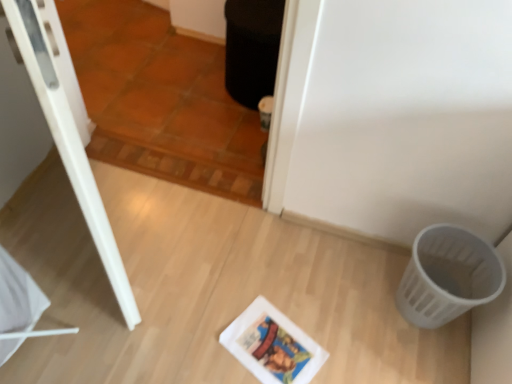
Find the location of a particular element. white plastic basket at lower right is located at coordinates (448, 276).

Find the location of a particular element. matte white comic book at center is located at coordinates (272, 345).

What's the angular difference between white plastic basket at lower right and matte white comic book at center's facing directions?

25.3 degrees separate the facing orientations of white plastic basket at lower right and matte white comic book at center.

Considering the relative positions of white plastic basket at lower right and matte white comic book at center in the image provided, is white plastic basket at lower right in front of matte white comic book at center?

Yes, the depth of white plastic basket at lower right is less than that of matte white comic book at center.

Is white plastic basket at lower right shorter than matte white comic book at center?

No.

From a real-world perspective, is brown terracotta tile at upper center beneath white plastic basket at lower right?

Actually, brown terracotta tile at upper center is physically above white plastic basket at lower right in the real world.

Considering the sizes of objects brown terracotta tile at upper center and white plastic basket at lower right in the image provided, who is thinner, brown terracotta tile at upper center or white plastic basket at lower right?

With smaller width is brown terracotta tile at upper center.

From their relative heights in the image, would you say brown terracotta tile at upper center is taller or shorter than white plastic basket at lower right?

In the image, brown terracotta tile at upper center appears to be taller than white plastic basket at lower right.

Is brown terracotta tile at upper center inside the boundaries of white plastic basket at lower right, or outside?

brown terracotta tile at upper center is outside white plastic basket at lower right.

From a real-world perspective, is matte white comic book at center above or below white plastic basket at lower right?

In terms of real-world spatial position, matte white comic book at center is below white plastic basket at lower right.

Can you confirm if matte white comic book at center is bigger than white plastic basket at lower right?

Incorrect, matte white comic book at center is not larger than white plastic basket at lower right.

Is matte white comic book at center turned away from white plastic basket at lower right?

No, matte white comic book at center's orientation is not away from white plastic basket at lower right.

Is matte white comic book at center situated inside white plastic basket at lower right or outside?

matte white comic book at center is spatially situated outside white plastic basket at lower right.

Does point (321, 362) lie behind point (82, 15)?

No.

Considering the sizes of objects matte white comic book at center and brown terracotta tile at upper center in the image provided, who is bigger, matte white comic book at center or brown terracotta tile at upper center?

With larger size is brown terracotta tile at upper center.

From the picture: Is matte white comic book at center not near brown terracotta tile at upper center?

matte white comic book at center is actually quite close to brown terracotta tile at upper center.

Based on the photo, how different are the orientations of matte white comic book at center and brown terracotta tile at upper center in degrees?

The angle between the facing direction of matte white comic book at center and the facing direction of brown terracotta tile at upper center is 24.6 degrees.

From the image's perspective, is brown terracotta tile at upper center above matte white comic book at center?

Yes, from the image's perspective, brown terracotta tile at upper center is on top of matte white comic book at center.

In the scene shown: Between brown terracotta tile at upper center and matte white comic book at center, which one has larger width?

matte white comic book at center is wider.

Is brown terracotta tile at upper center positioned behind matte white comic book at center?

No, it is in front of matte white comic book at center.

From a real-world perspective, is brown terracotta tile at upper center located higher than matte white comic book at center?

Yes.

From the image's perspective, is white plastic basket at lower right under brown terracotta tile at upper center?

Correct, white plastic basket at lower right appears lower than brown terracotta tile at upper center in the image.

Can you confirm if white plastic basket at lower right is shorter than brown terracotta tile at upper center?

Correct, white plastic basket at lower right is not as tall as brown terracotta tile at upper center.

Looking at this image, is white plastic basket at lower right not within brown terracotta tile at upper center?

Indeed, white plastic basket at lower right is completely outside brown terracotta tile at upper center.

In the image, there is a matte white comic book at center. Identify the location of basket above it (from the image's perspective). (448, 276).

Locate an element on the screen. basket behind the brown terracotta tile at upper center is located at coordinates point(448,276).

Based on their spatial positions, is brown terracotta tile at upper center or matte white comic book at center closer to white plastic basket at lower right?

The object closer to white plastic basket at lower right is matte white comic book at center.

Estimate the real-world distances between objects in this image. Which object is closer to matte white comic book at center, white plastic basket at lower right or brown terracotta tile at upper center?

white plastic basket at lower right lies closer to matte white comic book at center than the other object.

Which object lies further to the anchor point brown terracotta tile at upper center, matte white comic book at center or white plastic basket at lower right?

white plastic basket at lower right is further to brown terracotta tile at upper center.

Looking at the image, which one is located closer to brown terracotta tile at upper center, white plastic basket at lower right or matte white comic book at center?

Result: Based on the image, matte white comic book at center appears to be nearer to brown terracotta tile at upper center.

Which object lies further to the anchor point matte white comic book at center, brown terracotta tile at upper center or white plastic basket at lower right?

Based on the image, brown terracotta tile at upper center appears to be further to matte white comic book at center.

Considering their positions, is matte white comic book at center positioned further to white plastic basket at lower right than brown terracotta tile at upper center?

The object further to white plastic basket at lower right is brown terracotta tile at upper center.

This screenshot has width=512, height=384. I want to click on comic book situated between brown terracotta tile at upper center and white plastic basket at lower right from left to right, so click(272, 345).